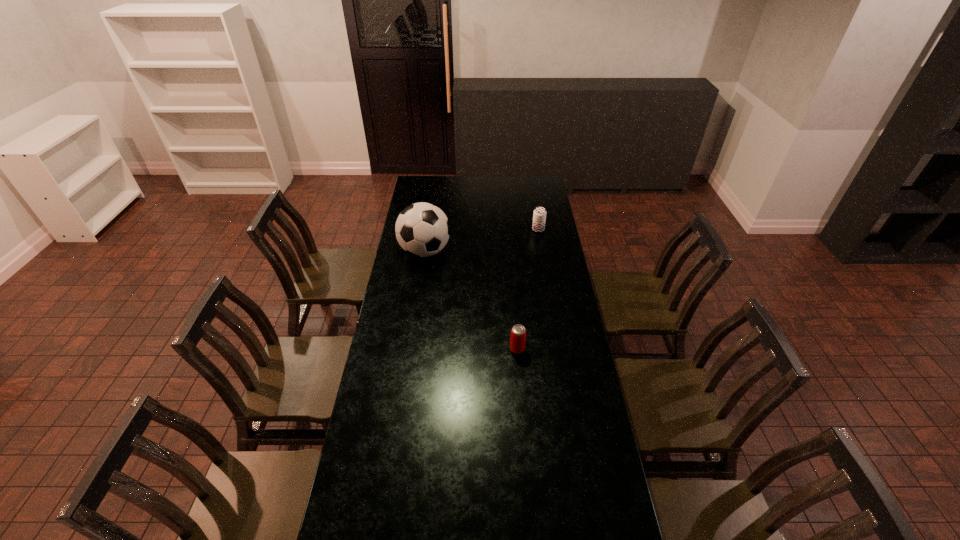
Where is `vacant space in between the nearer beer can and the second farthest object`? The height and width of the screenshot is (540, 960). vacant space in between the nearer beer can and the second farthest object is located at coordinates (471, 300).

Locate an element on the screen. The height and width of the screenshot is (540, 960). object that is the closest to the farther beer can is located at coordinates (422, 229).

Select which object is the second closest to the farther beer can. Please provide its 2D coordinates. Your answer should be formatted as a tuple, i.e. [(x, y)], where the tuple contains the x and y coordinates of a point satisfying the conditions above.

[(518, 333)]

Point out which beer can is positioned as the second nearest to the tallest object. Please provide its 2D coordinates. Your answer should be formatted as a tuple, i.e. [(x, y)], where the tuple contains the x and y coordinates of a point satisfying the conditions above.

[(518, 333)]

The height and width of the screenshot is (540, 960). What are the coordinates of `vacant space that satisfies the following two spatial constraints: 1. on the back side of the rightmost object; 2. on the right side of the left beer can` in the screenshot? It's located at (508, 230).

What are the coordinates of `free space that satisfies the following two spatial constraints: 1. on the back side of the leftmost object; 2. on the left side of the right beer can` in the screenshot? It's located at (428, 230).

In order to click on vacant region that satisfies the following two spatial constraints: 1. on the back side of the right beer can; 2. on the right side of the second object from right to left in this screenshot , I will do `click(508, 230)`.